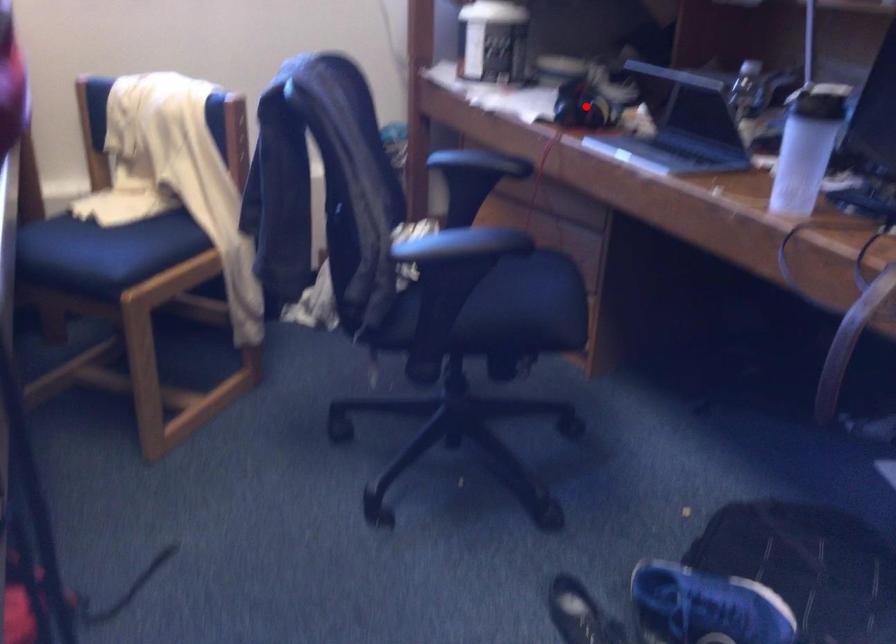
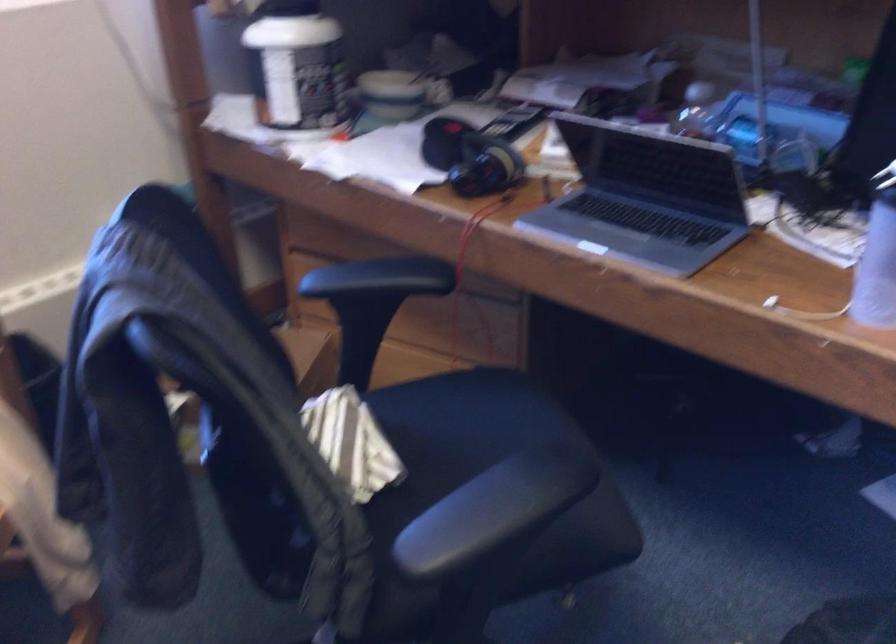
Find the pixel in the second image that matches the highlighted location in the first image.

(470, 158)